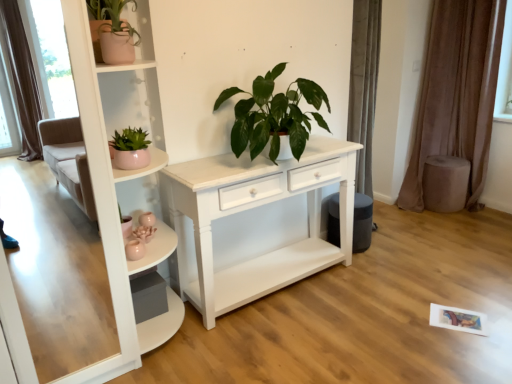
Question: Is matte pink pot at left, the 2th houseplant viewed from the right, at the left side of brown velvet curtain at right?

Choices:
 (A) yes
 (B) no

Answer: (A)

Question: From a real-world perspective, does matte pink pot at left, which is the 2th houseplant from left to right, stand above brown velvet curtain at right?

Choices:
 (A) yes
 (B) no

Answer: (A)

Question: Is matte pink pot at left, which is the 2th houseplant from left to right, facing away from brown velvet curtain at right?

Choices:
 (A) yes
 (B) no

Answer: (B)

Question: Is brown velvet curtain at right inside matte pink pot at left, the 2th houseplant viewed from the right?

Choices:
 (A) no
 (B) yes

Answer: (A)

Question: From the image's perspective, is matte pink pot at left, the 2th houseplant viewed from the right, below brown velvet curtain at right?

Choices:
 (A) yes
 (B) no

Answer: (A)

Question: Looking at their shapes, would you say green glossy plant at center, acting as the third houseplant starting from the left, is wider or thinner than brown velvet curtain at right?

Choices:
 (A) thin
 (B) wide

Answer: (B)

Question: From their relative heights in the image, would you say green glossy plant at center, marked as the first houseplant in a right-to-left arrangement, is taller or shorter than brown velvet curtain at right?

Choices:
 (A) tall
 (B) short

Answer: (B)

Question: Based on their sizes in the image, would you say green glossy plant at center, marked as the first houseplant in a right-to-left arrangement, is bigger or smaller than brown velvet curtain at right?

Choices:
 (A) small
 (B) big

Answer: (A)

Question: In the image, is green glossy plant at center, marked as the first houseplant in a right-to-left arrangement, on the left side or the right side of brown velvet curtain at right?

Choices:
 (A) left
 (B) right

Answer: (A)

Question: From the image's perspective, is green glossy plant at center, acting as the third houseplant starting from the left, positioned above or below matte pink pot at left, which is the 2th houseplant from left to right?

Choices:
 (A) below
 (B) above

Answer: (B)

Question: Which is correct: green glossy plant at center, marked as the first houseplant in a right-to-left arrangement, is inside matte pink pot at left, which is the 2th houseplant from left to right, or outside of it?

Choices:
 (A) inside
 (B) outside

Answer: (B)

Question: From a real-world perspective, is green glossy plant at center, marked as the first houseplant in a right-to-left arrangement, physically located above or below matte pink pot at left, the 2th houseplant viewed from the right?

Choices:
 (A) above
 (B) below

Answer: (A)

Question: Considering their positions, is green glossy plant at center, acting as the third houseplant starting from the left, located in front of or behind matte pink pot at left, which is the 2th houseplant from left to right?

Choices:
 (A) behind
 (B) front

Answer: (A)

Question: Is pink ceramic pot at upper left, the first houseplant positioned from the left, taller or shorter than green glossy plant at center, marked as the first houseplant in a right-to-left arrangement?

Choices:
 (A) tall
 (B) short

Answer: (B)

Question: Is pink ceramic pot at upper left, which ranks as the 3th houseplant in right-to-left order, in front of or behind green glossy plant at center, marked as the first houseplant in a right-to-left arrangement, in the image?

Choices:
 (A) front
 (B) behind

Answer: (A)